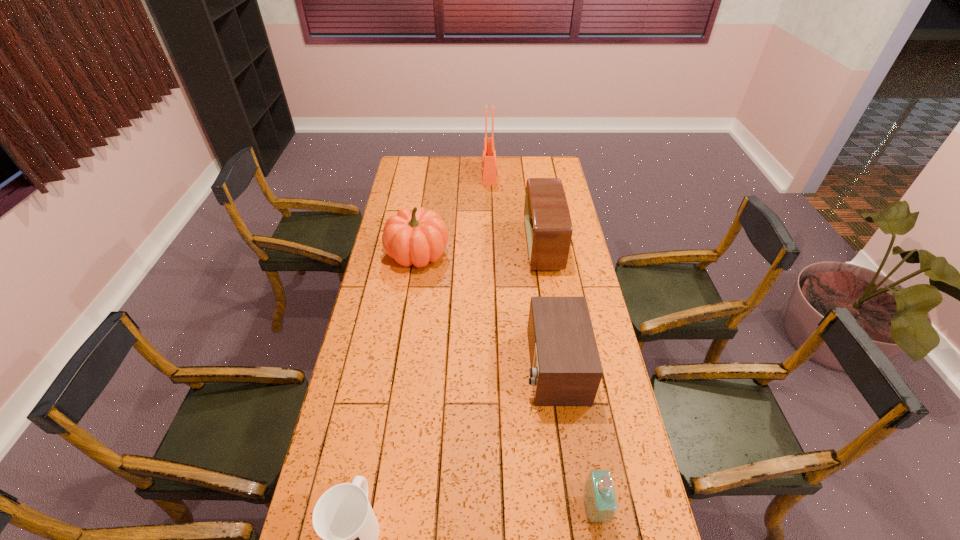
Locate an element on the screen. The image size is (960, 540). object located in the far edge section of the desktop is located at coordinates (489, 166).

Locate an element on the screen. The width and height of the screenshot is (960, 540). object situated at the left edge is located at coordinates (417, 237).

Locate an element on the screen. The width and height of the screenshot is (960, 540). perfume present at the right edge is located at coordinates (600, 500).

I want to click on free space at the far edge, so click(504, 178).

At what (x,y) coordinates should I click in order to perform the action: click on vacant area at the left edge of the desktop. Please return your answer as a coordinate pair (x, y). Image resolution: width=960 pixels, height=540 pixels. Looking at the image, I should click on (386, 284).

I want to click on vacant region at the right edge, so click(642, 516).

Image resolution: width=960 pixels, height=540 pixels. What are the coordinates of `vacant area at the far right corner of the desktop` in the screenshot? It's located at (540, 160).

Where is `vacant area between the pumpkin and the perfume`? The height and width of the screenshot is (540, 960). vacant area between the pumpkin and the perfume is located at coordinates (506, 381).

Find the location of a particular element. This screenshot has height=540, width=960. free space between the pumpkin and the perfume is located at coordinates (506, 381).

The width and height of the screenshot is (960, 540). I want to click on object that stands as the closest to the tallest object, so click(x=548, y=225).